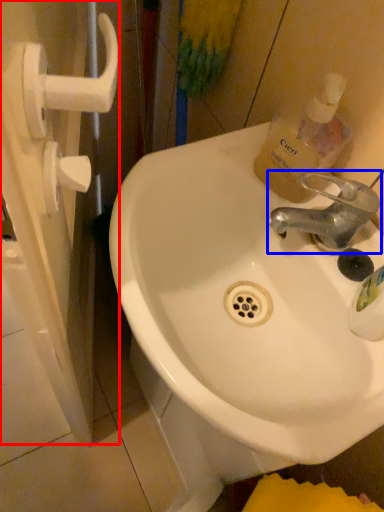
Question: Which object appears farthest to the camera in this image, screen door (highlighted by a red box) or tap (highlighted by a blue box)?

Choices:
 (A) screen door
 (B) tap

Answer: (B)